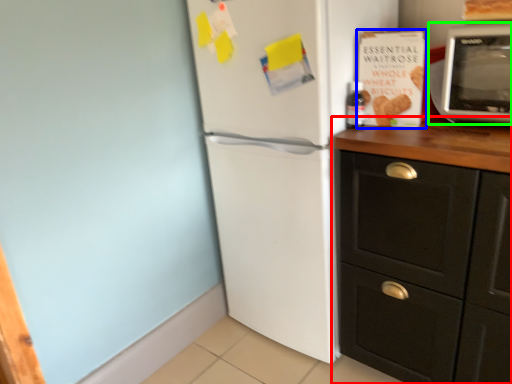
Question: Estimate the real-world distances between objects in this image. Which object is closer to cabinetry (highlighted by a red box), magazine (highlighted by a blue box) or microwave oven (highlighted by a green box)?

Choices:
 (A) magazine
 (B) microwave oven

Answer: (A)